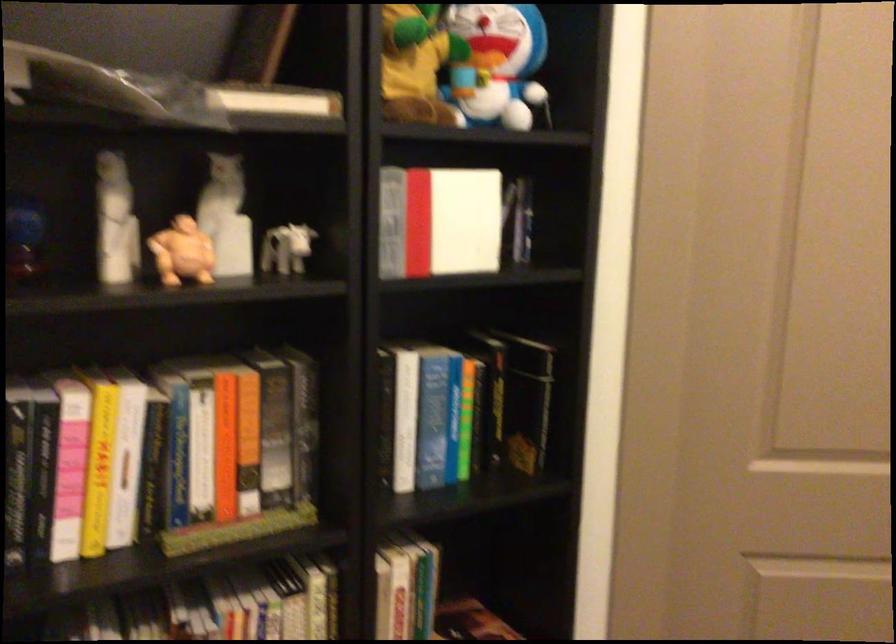
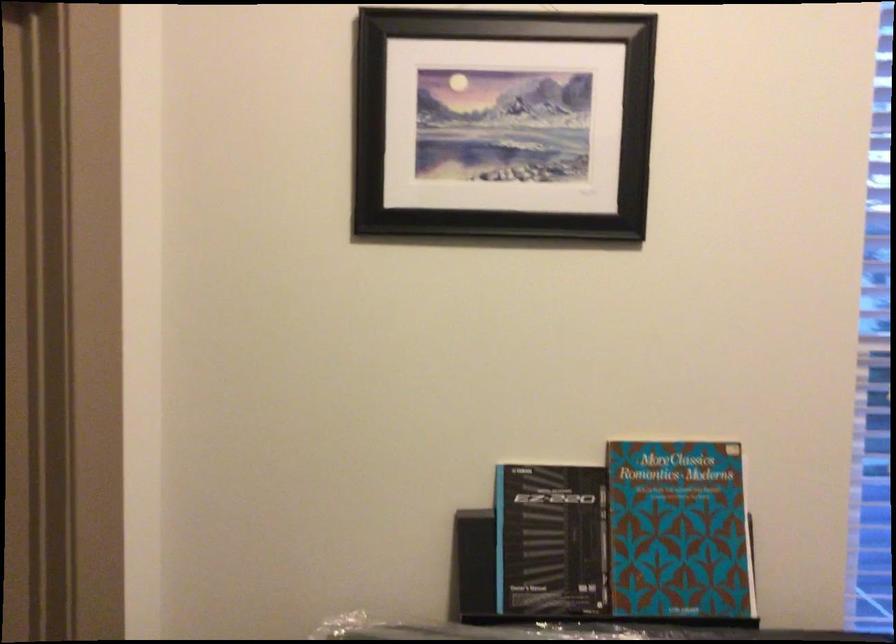
Question: The camera is either moving clockwise (left) or counter-clockwise (right) around the object. The first image is from the beginning of the video and the second image is from the end. Is the camera moving left or right when shooting the video?

Choices:
 (A) Left
 (B) Right

Answer: (A)